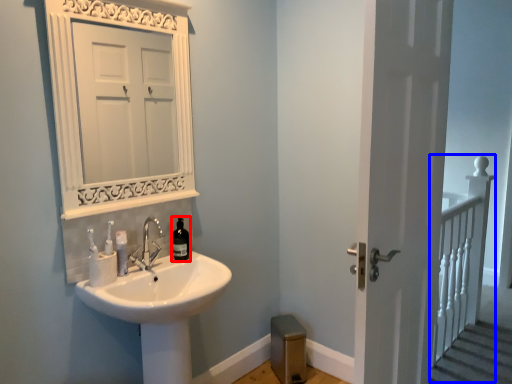
Question: Among these objects, which one is farthest to the camera, bottle (highlighted by a red box) or rail (highlighted by a blue box)?

Choices:
 (A) bottle
 (B) rail

Answer: (B)